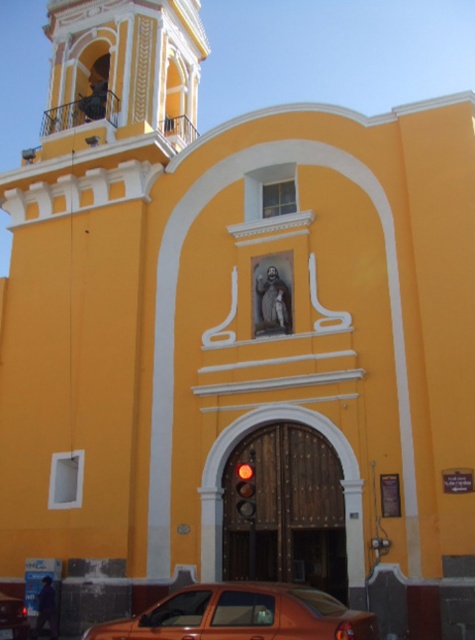
You are a delivery person needing to park your van between the orange metallic car at lower center and the orange matte car at lower left. The van requires 15 meters of space. Can you fit it between them?

The distance between the orange metallic car at lower center and the orange matte car at lower left is 13.74 meters, which is less than the required 15 meters. Therefore, the van cannot fit between them.

You are standing in front of the yellow building and want to park your orange metallic car. The car is currently at the point marked by coordinates point (241, 614). Is the car positioned at the lower center of the image?

Yes, the point (241, 614) marks the orange metallic car at lower center, so the car is indeed positioned at the lower center of the image.